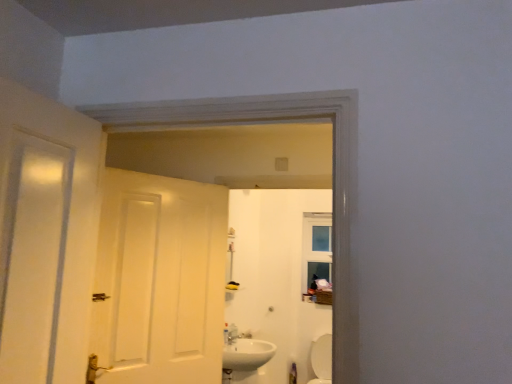
Question: Would you say white glossy toilet at lower right contains white matte door at center?

Choices:
 (A) yes
 (B) no

Answer: (B)

Question: Does white glossy toilet at lower right appear on the right side of white matte door at center?

Choices:
 (A) no
 (B) yes

Answer: (B)

Question: From a real-world perspective, is white glossy toilet at lower right below white matte door at center?

Choices:
 (A) yes
 (B) no

Answer: (A)

Question: Does white glossy toilet at lower right come behind white matte door at center?

Choices:
 (A) no
 (B) yes

Answer: (B)

Question: Is the position of white glossy toilet at lower right less distant than that of white matte door at center?

Choices:
 (A) yes
 (B) no

Answer: (B)

Question: Considering the relative sizes of white glossy toilet at lower right and white matte door at center in the image provided, is white glossy toilet at lower right bigger than white matte door at center?

Choices:
 (A) yes
 (B) no

Answer: (B)

Question: Does white glossy toilet at lower right have a greater width compared to white glossy sink at lower center?

Choices:
 (A) yes
 (B) no

Answer: (A)

Question: Is white glossy toilet at lower right positioned beyond the bounds of white glossy sink at lower center?

Choices:
 (A) no
 (B) yes

Answer: (B)

Question: From a real-world perspective, is white glossy toilet at lower right below white glossy sink at lower center?

Choices:
 (A) yes
 (B) no

Answer: (A)

Question: Is white glossy toilet at lower right further to the viewer compared to white glossy sink at lower center?

Choices:
 (A) yes
 (B) no

Answer: (A)

Question: From the image's perspective, is white glossy toilet at lower right under white glossy sink at lower center?

Choices:
 (A) no
 (B) yes

Answer: (B)

Question: Is white glossy toilet at lower right far from white glossy sink at lower center?

Choices:
 (A) no
 (B) yes

Answer: (B)

Question: Is white glossy sink at lower center not inside white glossy toilet at lower right?

Choices:
 (A) no
 (B) yes

Answer: (B)